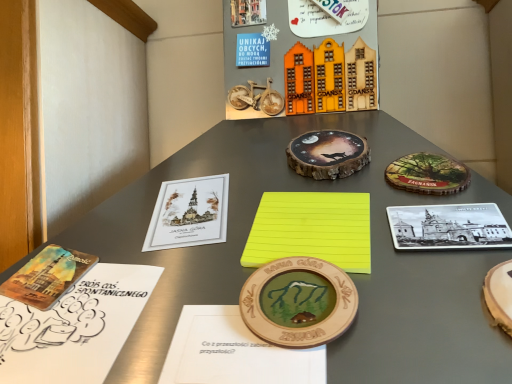
Question: Looking at their shapes, would you say matte paper book at center left, the second book when ordered from right to left, is wider or thinner than white paper notebook at lower left, acting as the third notebook starting from the right?

Choices:
 (A) wide
 (B) thin

Answer: (A)

Question: From a real-world perspective, is matte paper book at center left, the second book when ordered from right to left, above or below white paper notebook at lower left, the 1th notebook when ordered from left to right?

Choices:
 (A) above
 (B) below

Answer: (A)

Question: Which of these objects is positioned closest to the wooden coaster at center, the second coin in the front-to-back sequence?

Choices:
 (A) wooden notebook at center, acting as the 2th notebook starting from the right
 (B) yellow matte paper at center
 (C) white paper notebook at lower left, the 1th notebook when ordered from left to right
 (D) black and white ceramic plate at upper right, which is the third book from left to right
 (E) matte paper book at center left, the second book when ordered from right to left

Answer: (D)

Question: Which object is positioned farthest from the black and white ceramic plate at upper right, positioned as the first book in right-to-left order?

Choices:
 (A) yellow paper at center, arranged as the 1th notebook when viewed from the right
 (B) wooden coaster at center, placed as the 1th coin when sorted from top to bottom
 (C) wooden notebook at center, acting as the 2th notebook starting from the right
 (D) white paper notebook at lower left, the 1th notebook when ordered from left to right
 (E) yellow matte paper at center

Answer: (D)